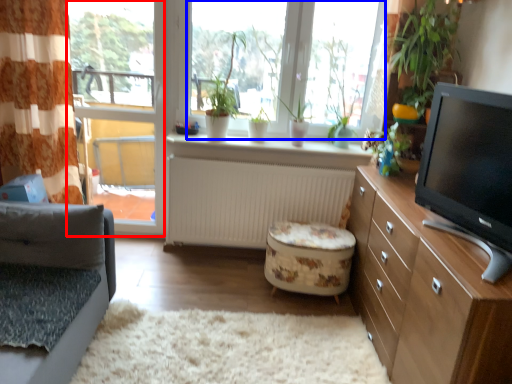
Question: Which of the following is the farthest to the observer, window frame (highlighted by a red box) or bay window (highlighted by a blue box)?

Choices:
 (A) window frame
 (B) bay window

Answer: (A)